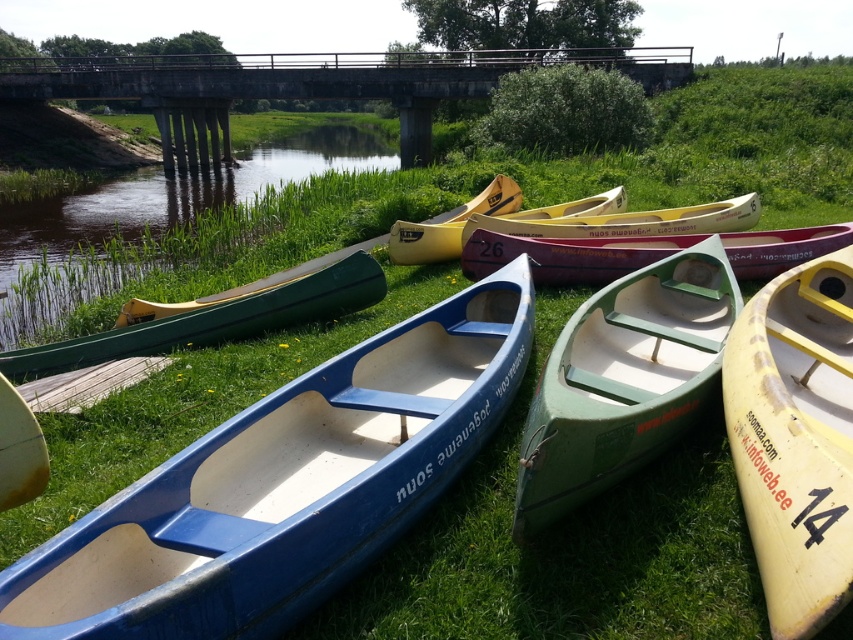
Question: Is concrete bridge at upper center above green plastic river at left?

Choices:
 (A) no
 (B) yes

Answer: (B)

Question: Which point is farther from the camera taking this photo?

Choices:
 (A) (426, 237)
 (B) (215, 179)
 (C) (67, 602)

Answer: (B)

Question: Can you confirm if blue plastic canoe at center is bigger than green plastic river at left?

Choices:
 (A) no
 (B) yes

Answer: (A)

Question: Does yellow matte canoe at lower right have a greater width compared to green matte canoe at left?

Choices:
 (A) yes
 (B) no

Answer: (B)

Question: Among these objects, which one is farthest from the camera?

Choices:
 (A) green matte canoe at left
 (B) yellow matte canoe at lower right
 (C) blue plastic canoe at center
 (D) matte green canoe at center

Answer: (D)

Question: Which object is farther from the camera taking this photo?

Choices:
 (A) concrete bridge at upper center
 (B) yellow matte canoe at lower right
 (C) green matte boat at center

Answer: (A)